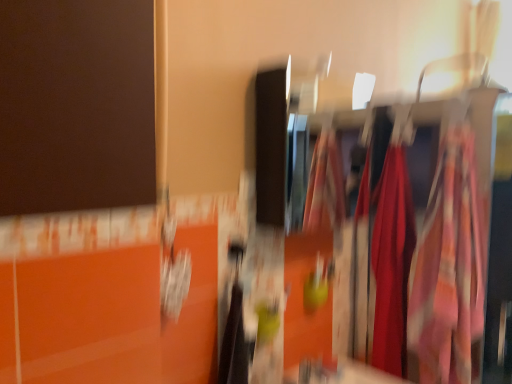
Question: Is silky red fabric at center, marked as the 1th clothing in a back-to-front arrangement, not within silky fabric dress at right?

Choices:
 (A) yes
 (B) no

Answer: (B)

Question: Considering the relative positions of silky red fabric at center, marked as the 1th clothing in a back-to-front arrangement, and silky fabric dress at right in the image provided, is silky red fabric at center, marked as the 1th clothing in a back-to-front arrangement, behind silky fabric dress at right?

Choices:
 (A) yes
 (B) no

Answer: (A)

Question: Is silky red fabric at center, positioned as the second clothing in front-to-back order, shorter than silky fabric dress at right?

Choices:
 (A) no
 (B) yes

Answer: (B)

Question: Can you confirm if silky red fabric at center, positioned as the second clothing in front-to-back order, is thinner than silky fabric dress at right?

Choices:
 (A) yes
 (B) no

Answer: (A)

Question: Is silky red fabric at center, marked as the 1th clothing in a back-to-front arrangement, positioned before silky fabric dress at right?

Choices:
 (A) no
 (B) yes

Answer: (A)

Question: Is silky red fabric at center, marked as the 1th clothing in a back-to-front arrangement, situated inside floral fabric dress at right, the 2th clothing in the back-to-front sequence, or outside?

Choices:
 (A) inside
 (B) outside

Answer: (B)

Question: Is silky red fabric at center, positioned as the second clothing in front-to-back order, wider or thinner than floral fabric dress at right, the 2th clothing in the back-to-front sequence?

Choices:
 (A) thin
 (B) wide

Answer: (A)

Question: From a real-world perspective, is silky red fabric at center, positioned as the second clothing in front-to-back order, physically located above or below floral fabric dress at right, the 2th clothing in the back-to-front sequence?

Choices:
 (A) below
 (B) above

Answer: (A)

Question: In terms of height, does silky red fabric at center, marked as the 1th clothing in a back-to-front arrangement, look taller or shorter compared to floral fabric dress at right, the 2th clothing in the back-to-front sequence?

Choices:
 (A) tall
 (B) short

Answer: (A)

Question: Would you say silky fabric dress at right is to the left or to the right of silky red fabric at center, positioned as the second clothing in front-to-back order, in the picture?

Choices:
 (A) right
 (B) left

Answer: (A)

Question: In terms of size, does silky fabric dress at right appear bigger or smaller than silky red fabric at center, positioned as the second clothing in front-to-back order?

Choices:
 (A) small
 (B) big

Answer: (B)

Question: Considering the positions of point (329, 170) and point (401, 324), is point (329, 170) closer or farther from the camera than point (401, 324)?

Choices:
 (A) closer
 (B) farther

Answer: (B)

Question: Is silky fabric dress at right inside the boundaries of silky red fabric at center, positioned as the second clothing in front-to-back order, or outside?

Choices:
 (A) outside
 (B) inside

Answer: (A)

Question: In terms of width, does floral fabric dress at right, the 1th clothing when ordered from front to back, look wider or thinner when compared to silky red fabric at center, marked as the 1th clothing in a back-to-front arrangement?

Choices:
 (A) wide
 (B) thin

Answer: (A)

Question: Considering the positions of floral fabric dress at right, the 2th clothing in the back-to-front sequence, and silky red fabric at center, positioned as the second clothing in front-to-back order, in the image, is floral fabric dress at right, the 2th clothing in the back-to-front sequence, bigger or smaller than silky red fabric at center, positioned as the second clothing in front-to-back order,?

Choices:
 (A) big
 (B) small

Answer: (A)